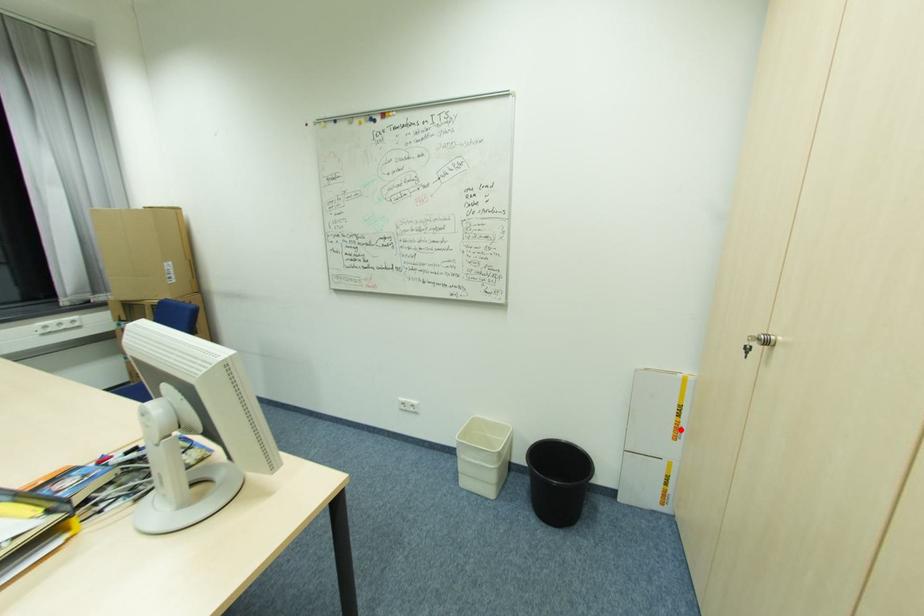
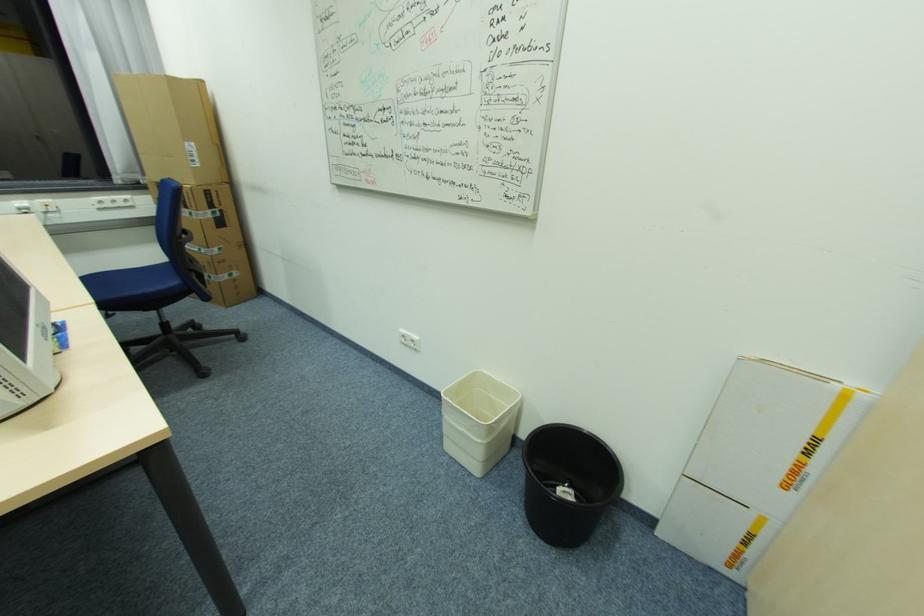
The point at the highlighted location is marked in the first image. Where is the corresponding point in the second image?

(797, 472)